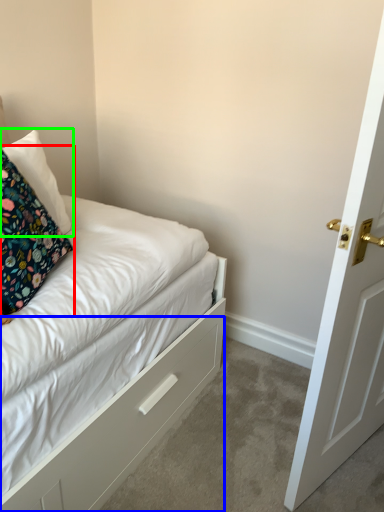
Question: Estimate the real-world distances between objects in this image. Which object is closer to pillow (highlighted by a red box), drawer (highlighted by a blue box) or pillow (highlighted by a green box)?

Choices:
 (A) drawer
 (B) pillow

Answer: (B)